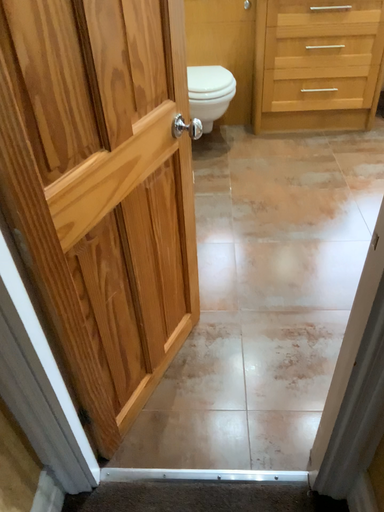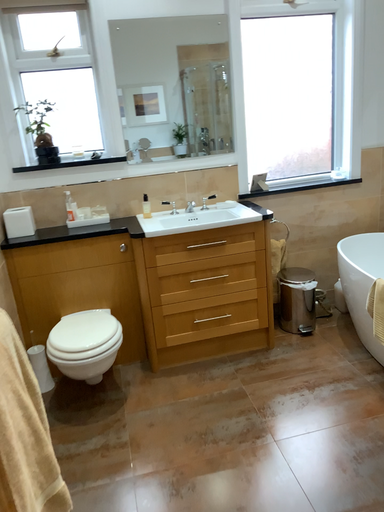
Question: How did the camera likely rotate when shooting the video?

Choices:
 (A) rotated upward
 (B) rotated downward

Answer: (A)